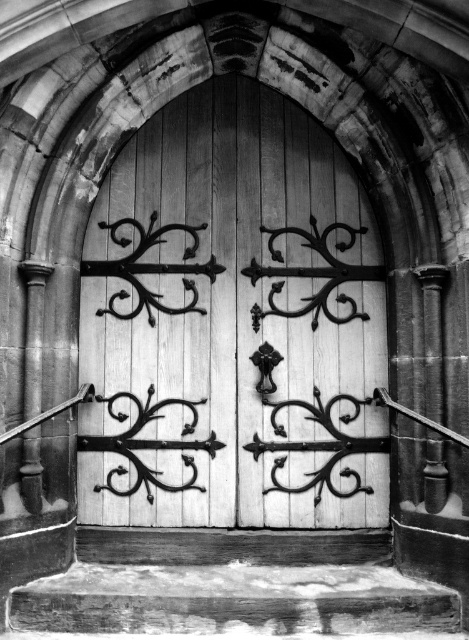
The height and width of the screenshot is (640, 469). Describe the element at coordinates (233, 323) in the screenshot. I see `white wood door at center` at that location.

Is white wood door at center closer to the viewer compared to wooden at lower center?

No.

Which is in front, point (286, 259) or point (45, 600)?

Point (45, 600) is in front.

In order to click on white wood door at center in this screenshot , I will do `click(233, 323)`.